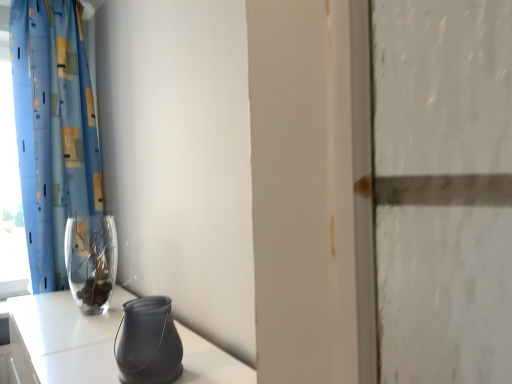
Question: From the image's perspective, is matte black vase at lower center, positioned as the 2th vase in back-to-front order, beneath blue printed fabric curtain at left?

Choices:
 (A) no
 (B) yes

Answer: (B)

Question: Considering the relative sizes of matte black vase at lower center, which is counted as the first vase, starting from the right, and blue printed fabric curtain at left in the image provided, is matte black vase at lower center, which is counted as the first vase, starting from the right, taller than blue printed fabric curtain at left?

Choices:
 (A) no
 (B) yes

Answer: (A)

Question: Is matte black vase at lower center, positioned as the 2th vase in back-to-front order, wider than blue printed fabric curtain at left?

Choices:
 (A) yes
 (B) no

Answer: (B)

Question: Are matte black vase at lower center, which is counted as the first vase, starting from the right, and blue printed fabric curtain at left beside each other?

Choices:
 (A) yes
 (B) no

Answer: (B)

Question: Is matte black vase at lower center, which appears as the second vase when viewed from the left, smaller than blue printed fabric curtain at left?

Choices:
 (A) yes
 (B) no

Answer: (A)

Question: Is point [x=10, y=241] closer or farther from the camera than point [x=19, y=69]?

Choices:
 (A) closer
 (B) farther

Answer: (B)

Question: From the image's perspective, is transparent glass window at left above or below blue printed fabric curtain at left?

Choices:
 (A) above
 (B) below

Answer: (B)

Question: Which is correct: transparent glass window at left is inside blue printed fabric curtain at left, or outside of it?

Choices:
 (A) outside
 (B) inside

Answer: (A)

Question: In terms of size, does transparent glass window at left appear bigger or smaller than blue printed fabric curtain at left?

Choices:
 (A) big
 (B) small

Answer: (B)

Question: In terms of height, does transparent glass window at left look taller or shorter compared to matte black vase at lower center, positioned as the 2th vase in back-to-front order?

Choices:
 (A) short
 (B) tall

Answer: (B)

Question: Does point (13, 187) appear closer or farther from the camera than point (141, 297)?

Choices:
 (A) farther
 (B) closer

Answer: (A)

Question: In terms of size, does transparent glass window at left appear bigger or smaller than matte black vase at lower center, positioned as the 2th vase in back-to-front order?

Choices:
 (A) small
 (B) big

Answer: (B)

Question: From the image's perspective, is transparent glass window at left positioned above or below matte black vase at lower center, which is counted as the first vase, starting from the right?

Choices:
 (A) below
 (B) above

Answer: (B)

Question: From a real-world perspective, relative to transparent glass window at left, is matte black vase at lower center, which appears as the second vase when viewed from the left, vertically above or below?

Choices:
 (A) above
 (B) below

Answer: (B)

Question: Based on their positions, is matte black vase at lower center, the 1th vase in the front-to-back sequence, located to the left or right of transparent glass window at left?

Choices:
 (A) right
 (B) left

Answer: (A)